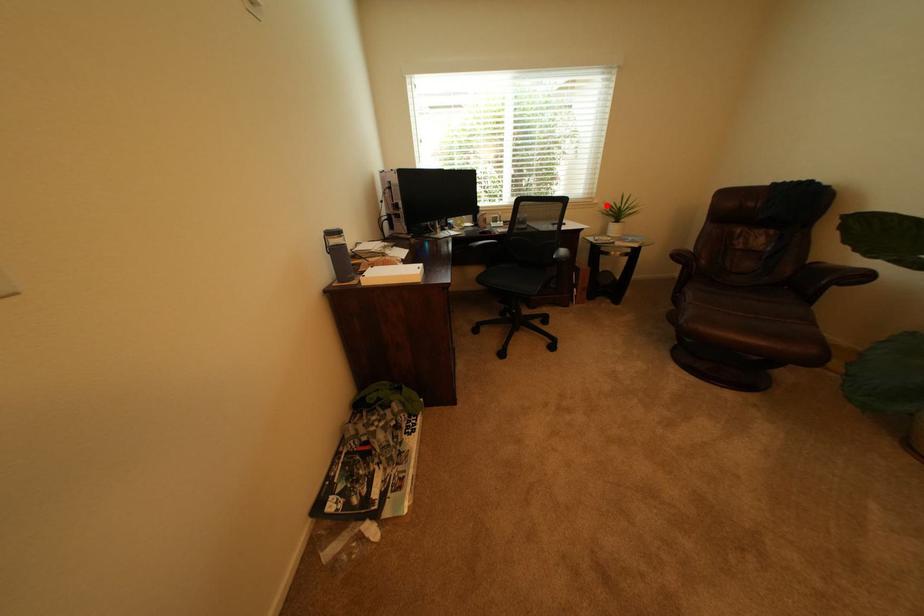
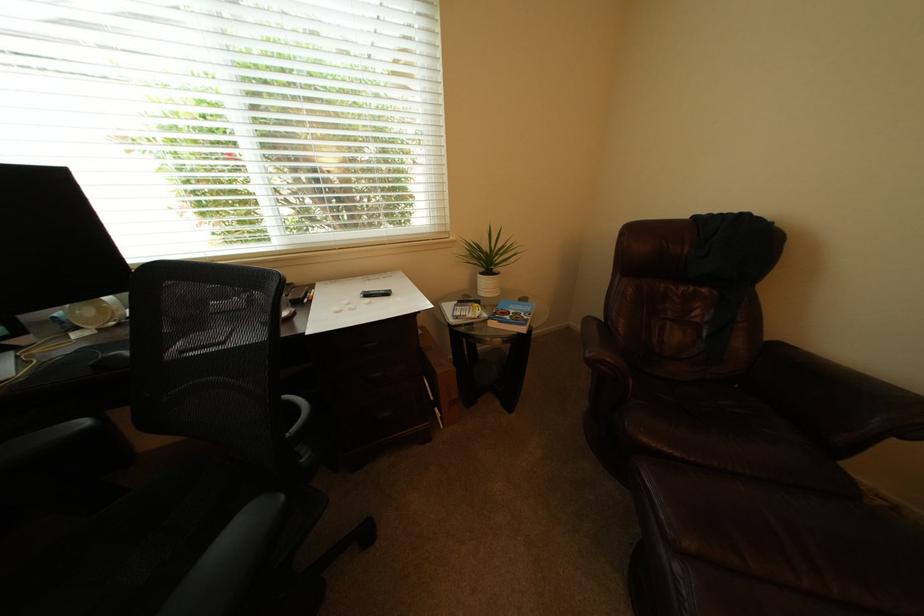
Question: I am providing you with two images of the same scene from different viewpoints. A red point is marked on the first image. Can you still see the location of the red point in image 2?

Choices:
 (A) Yes
 (B) No

Answer: (A)